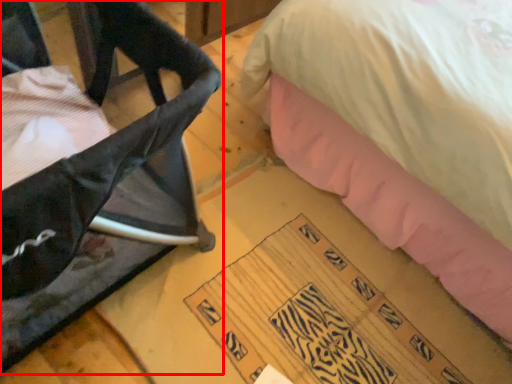
Question: Considering the relative positions of furniture (annotated by the red box) and writing in the image provided, where is furniture (annotated by the red box) located with respect to the staircase?

Choices:
 (A) right
 (B) left

Answer: (B)